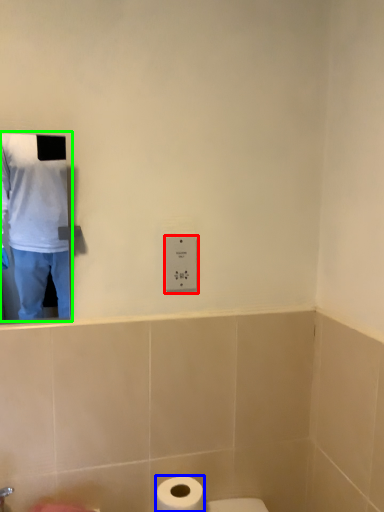
Question: Which object is positioned closest to electric outlet (highlighted by a red box)? Select from toilet paper (highlighted by a blue box) and man (highlighted by a green box).

Choices:
 (A) toilet paper
 (B) man

Answer: (A)